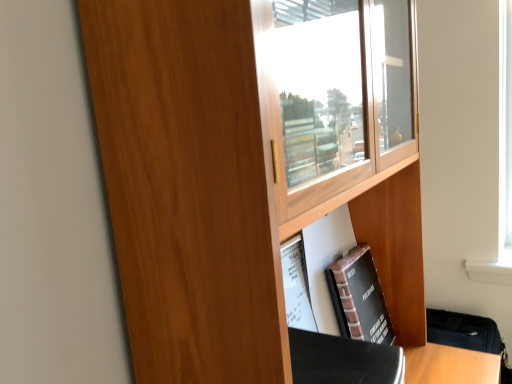
Question: Is wooden cupboard at center next to black matte book at lower right?

Choices:
 (A) no
 (B) yes

Answer: (A)

Question: Could you tell me if wooden cupboard at center is turned towards black matte book at lower right?

Choices:
 (A) no
 (B) yes

Answer: (B)

Question: From a real-world perspective, is wooden cupboard at center beneath black matte book at lower right?

Choices:
 (A) no
 (B) yes

Answer: (A)

Question: Is wooden cupboard at center thinner than black matte book at lower right?

Choices:
 (A) no
 (B) yes

Answer: (A)

Question: Can you confirm if wooden cupboard at center is positioned to the right of black matte book at lower right?

Choices:
 (A) yes
 (B) no

Answer: (B)

Question: Does wooden cupboard at center have a greater width compared to black matte book at lower right?

Choices:
 (A) no
 (B) yes

Answer: (B)

Question: Does black matte book at lower right have a lesser height compared to wooden cupboard at center?

Choices:
 (A) yes
 (B) no

Answer: (A)

Question: Is black matte book at lower right located outside wooden cupboard at center?

Choices:
 (A) yes
 (B) no

Answer: (B)

Question: From the image's perspective, is black matte book at lower right below wooden cupboard at center?

Choices:
 (A) no
 (B) yes

Answer: (B)

Question: Is wooden cupboard at center at the back of black matte book at lower right?

Choices:
 (A) yes
 (B) no

Answer: (A)

Question: Would you say black matte book at lower right is a long distance from wooden cupboard at center?

Choices:
 (A) yes
 (B) no

Answer: (B)

Question: Can you confirm if black matte book at lower right is smaller than wooden cupboard at center?

Choices:
 (A) yes
 (B) no

Answer: (A)

Question: Is black matte book at lower right spatially inside wooden cupboard at center, or outside of it?

Choices:
 (A) outside
 (B) inside

Answer: (B)